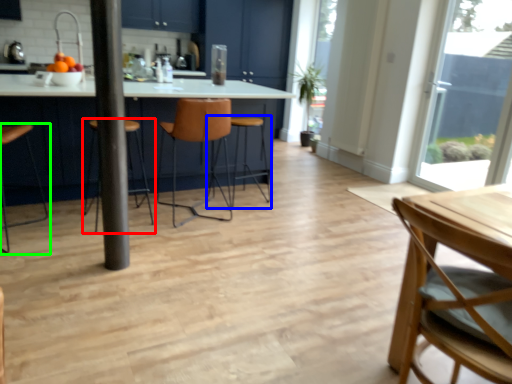
Question: Which is farther away from chair (highlighted by a red box)? bar stool (highlighted by a blue box) or chair (highlighted by a green box)?

Choices:
 (A) bar stool
 (B) chair

Answer: (A)